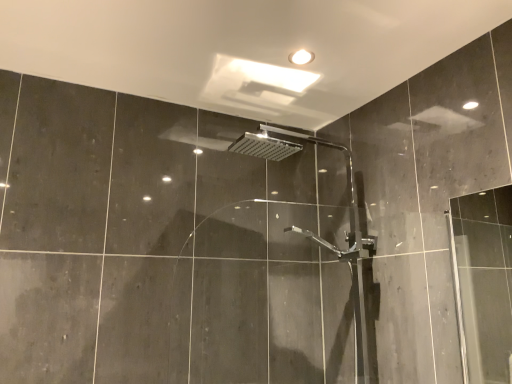
Question: Looking at their shapes, would you say chrome metallic shower head at center is wider or thinner than white glossy light fixture at upper center?

Choices:
 (A) thin
 (B) wide

Answer: (B)

Question: Considering the relative positions of chrome metallic shower head at center and white glossy light fixture at upper center in the image provided, is chrome metallic shower head at center to the left or to the right of white glossy light fixture at upper center?

Choices:
 (A) left
 (B) right

Answer: (B)

Question: In terms of size, does chrome metallic shower head at center appear bigger or smaller than white glossy light fixture at upper center?

Choices:
 (A) small
 (B) big

Answer: (B)

Question: From their relative heights in the image, would you say white glossy light fixture at upper center is taller or shorter than chrome metallic shower head at center?

Choices:
 (A) tall
 (B) short

Answer: (B)

Question: Is white glossy light fixture at upper center inside or outside of chrome metallic shower head at center?

Choices:
 (A) outside
 (B) inside

Answer: (A)

Question: Relative to chrome metallic shower head at center, is white glossy light fixture at upper center in front or behind?

Choices:
 (A) front
 (B) behind

Answer: (B)

Question: From the image's perspective, is white glossy light fixture at upper center above or below chrome metallic shower head at center?

Choices:
 (A) below
 (B) above

Answer: (B)